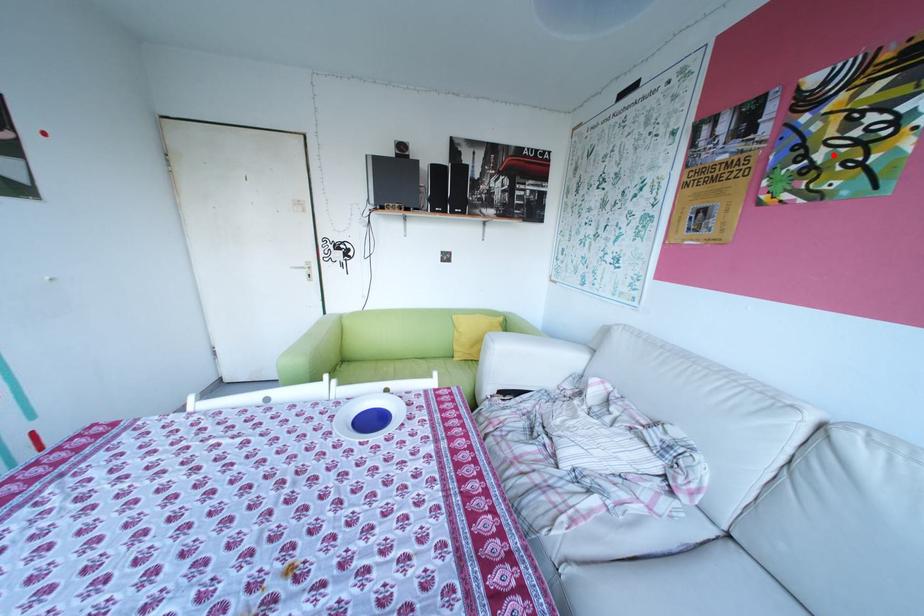
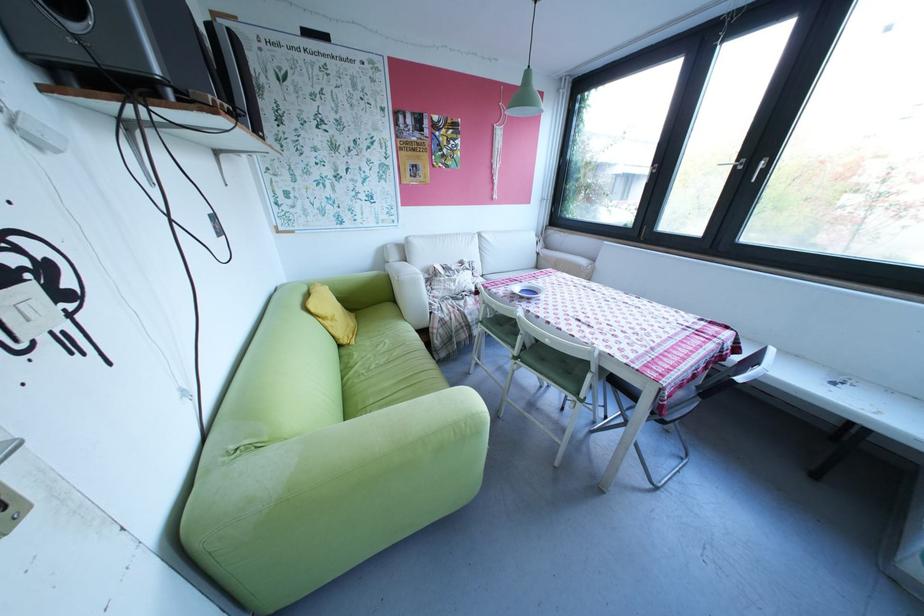
Question: A red point is marked in image1. In image2, is the corresponding 3D point closer to the camera or farther? Reply with the corresponding letter.

Choices:
 (A) The corresponding 3D point is closer.
 (B) The corresponding 3D point is farther.

Answer: (A)